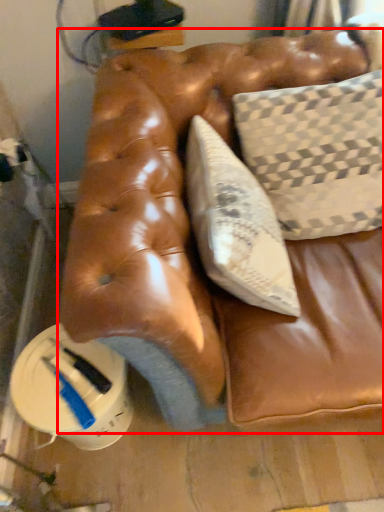
Question: From the image's perspective, what is the correct spatial relationship of furniture (annotated by the red box) in relation to pillow?

Choices:
 (A) above
 (B) below

Answer: (B)